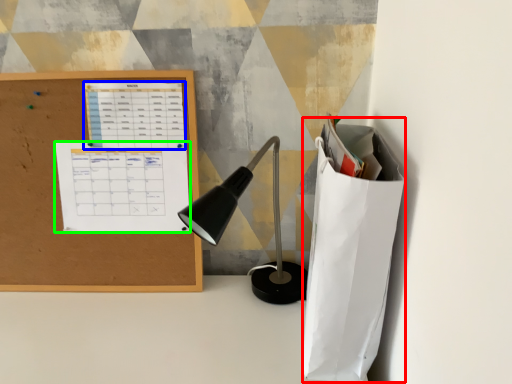
Question: Considering the real-world distances, which object is farthest from paper bag (highlighted by a red box)? notebook (highlighted by a blue box) or notebook (highlighted by a green box)?

Choices:
 (A) notebook
 (B) notebook

Answer: (A)